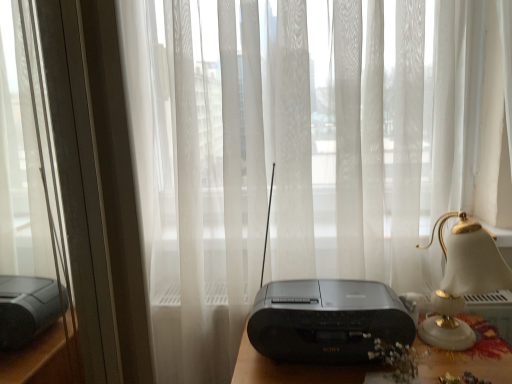
Question: From a real-world perspective, is white glossy bedside lamp at right physically located above or below black plastic radio at center?

Choices:
 (A) above
 (B) below

Answer: (B)

Question: Visually, is white glossy bedside lamp at right positioned to the left or to the right of black plastic radio at center?

Choices:
 (A) right
 (B) left

Answer: (A)

Question: Based on their relative distances, which object is farther from the metallic silver window frame at left?

Choices:
 (A) black plastic radio at center
 (B) black plastic radio at center
 (C) white glossy bedside lamp at right

Answer: (C)

Question: Which of these objects is positioned farthest from the white glossy bedside lamp at right?

Choices:
 (A) metallic silver window frame at left
 (B) black plastic radio at center
 (C) black plastic radio at center

Answer: (A)